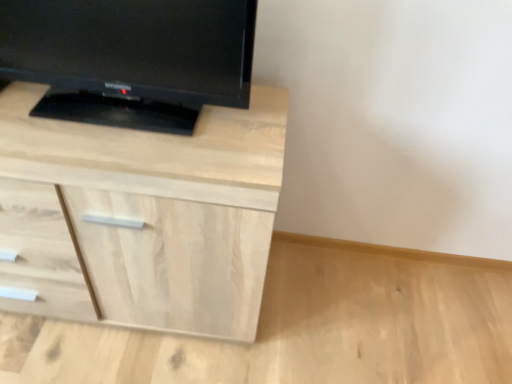
Identify the location of blank space situated above light wood chest of drawers at upper left (from a real-world perspective). point(122,115).